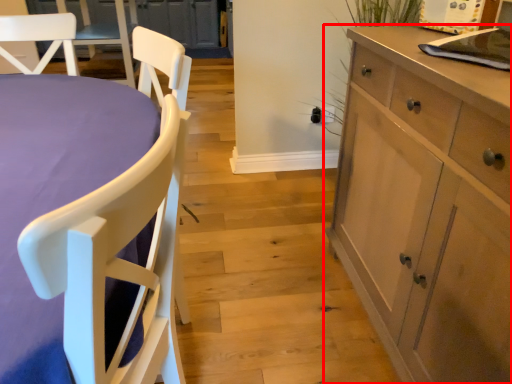
Question: From the image's perspective, considering the relative positions of cabinetry (annotated by the red box) and chair in the image provided, where is cabinetry (annotated by the red box) located with respect to the staircase?

Choices:
 (A) below
 (B) above

Answer: (B)